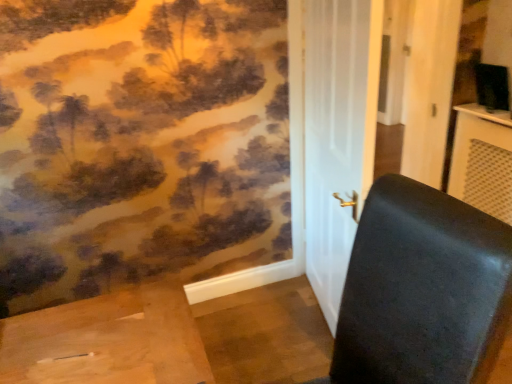
Question: From the image's perspective, is matte black table at right located above black leather chair at right?

Choices:
 (A) yes
 (B) no

Answer: (A)

Question: Does matte black table at right have a lesser height compared to black leather chair at right?

Choices:
 (A) no
 (B) yes

Answer: (B)

Question: Is black leather chair at right located within matte black table at right?

Choices:
 (A) no
 (B) yes

Answer: (A)

Question: Does matte black table at right have a smaller size compared to black leather chair at right?

Choices:
 (A) no
 (B) yes

Answer: (B)

Question: Can you confirm if matte black table at right is taller than black leather chair at right?

Choices:
 (A) yes
 (B) no

Answer: (B)

Question: Is point (480, 120) positioned closer to the camera than point (391, 286)?

Choices:
 (A) farther
 (B) closer

Answer: (A)

Question: Is matte black table at right wider or thinner than black leather chair at right?

Choices:
 (A) thin
 (B) wide

Answer: (A)

Question: Is matte black table at right taller or shorter than black leather chair at right?

Choices:
 (A) tall
 (B) short

Answer: (B)

Question: Visually, is matte black table at right positioned to the left or to the right of black leather chair at right?

Choices:
 (A) right
 (B) left

Answer: (A)

Question: Relative to matte black table at right, is white glossy door at center in front or behind?

Choices:
 (A) behind
 (B) front

Answer: (B)

Question: From a real-world perspective, relative to matte black table at right, is white glossy door at center vertically above or below?

Choices:
 (A) below
 (B) above

Answer: (B)

Question: Choose the correct answer: Is white glossy door at center inside matte black table at right or outside it?

Choices:
 (A) outside
 (B) inside

Answer: (A)

Question: Visually, is white glossy door at center positioned to the left or to the right of matte black table at right?

Choices:
 (A) right
 (B) left

Answer: (B)

Question: In the image, is matte black table at right positioned in front of or behind white glossy door at center?

Choices:
 (A) behind
 (B) front

Answer: (A)

Question: Based on their sizes in the image, would you say matte black table at right is bigger or smaller than white glossy door at center?

Choices:
 (A) small
 (B) big

Answer: (A)